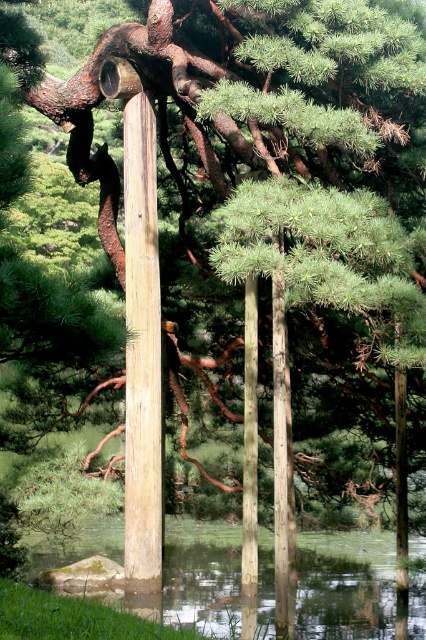
You are standing at the edge of a garden pond and see the clear water at center. If you want to throw a small pebble into the water, will the distance be too far for an average person to reach?

The clear water at center is 16.03 meters away from viewer. An average person can throw about 10 to 15 meters, so it might be too far to reach.

You are standing on the path leading to the garden and see the clear water at center and the smooth gray pole at center. Which object is closer to your right side?

The smooth gray pole at center is closer to your right side because the clear water at center is to the left of it.